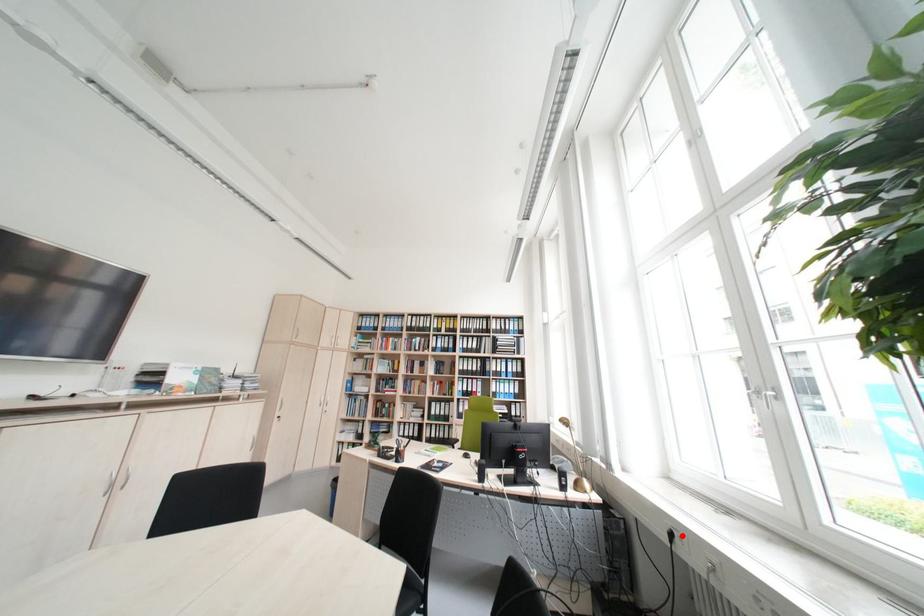
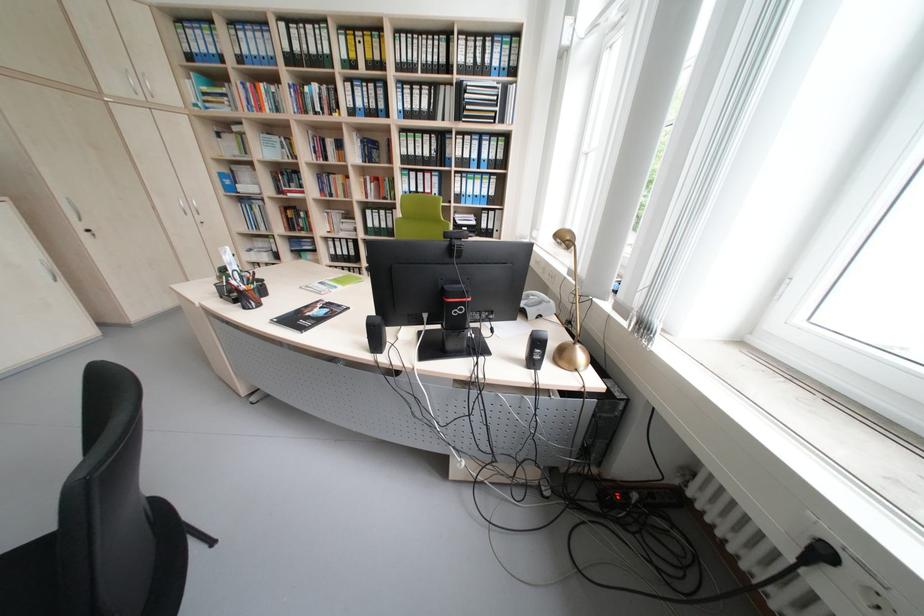
Find the pixel in the second image that matches the highlighted location in the first image.

(833, 554)